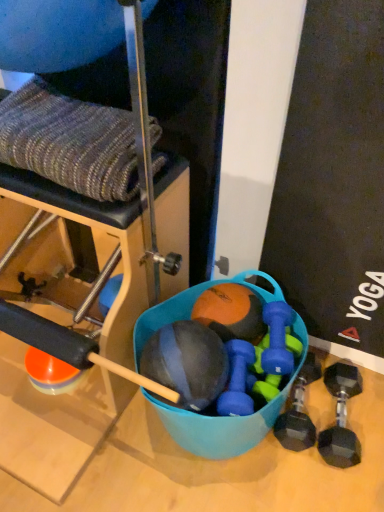
Question: Relative to orange matte ball at center, which is the first ball in back-to-front order, is blue rubber bucket at center in front or behind?

Choices:
 (A) behind
 (B) front

Answer: (B)

Question: Is blue rubber bucket at center taller or shorter than orange matte ball at center, which is the 2th ball from front to back?

Choices:
 (A) tall
 (B) short

Answer: (A)

Question: Which is farther from the matte black dumbbell at lower right, which is the third dumbbell in left-to-right order?

Choices:
 (A) matte black medicine ball at center, the first ball positioned from the front
 (B) black rubber dumbbell at lower right, positioned as the 4th dumbbell in left-to-right order
 (C) orange matte ball at center, which is the 2th ball from front to back
 (D) blue rubber dumbbell at center, the first dumbbell from the left
 (E) knitted fabric at upper left

Answer: (E)

Question: Based on their relative distances, which object is nearer to the black rubber dumbbell at lower right, positioned as the 4th dumbbell in left-to-right order?

Choices:
 (A) knitted fabric at upper left
 (B) orange matte ball at center, which is the 2th ball from front to back
 (C) matte black dumbbell at lower right, which is counted as the 2th dumbbell, starting from the right
 (D) matte black medicine ball at center, the first ball positioned from the front
 (E) blue rubber dumbbell at center, which ranks as the second dumbbell in left-to-right order

Answer: (C)